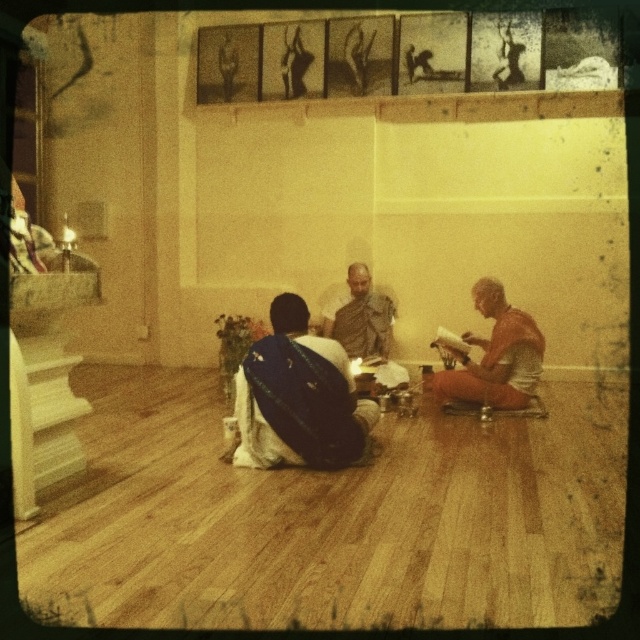
You are a photographer trying to capture a closeup of the blue silk saree at center and the orange cotton cloth at right. Since you want both items to be in focus, which one should you focus on first, the one closer to you or the one farther away?

The blue silk saree at center is located below orange cotton cloth at right, meaning it is farther away from you. To ensure both are in focus, you should focus on the farther object first, which is the blue silk saree at center.

You are organizing a small meditation session in a room with limited space. You have an orange cotton cloth at right and a matte brown robe at center. Which item should you choose if you need to place something wider on the floor?

The orange cotton cloth at right is wider than the matte brown robe at center, so you should choose the orange cotton cloth at right to place on the floor since it requires more space.